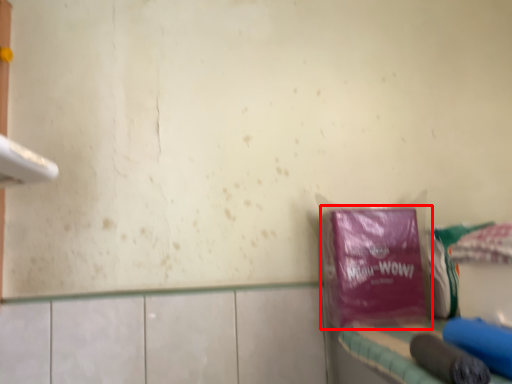
Question: From the image's perspective, what is the correct spatial relationship of plastic bag (annotated by the red box) in relation to vanity?

Choices:
 (A) below
 (B) above

Answer: (B)